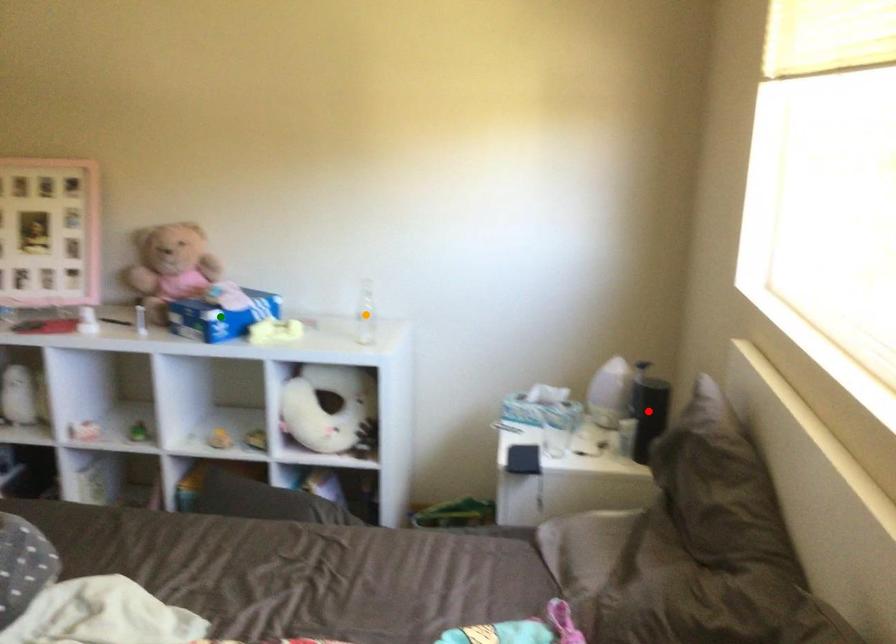
Order these from nearest to farthest:
A) green point
B) orange point
C) red point

red point, green point, orange point